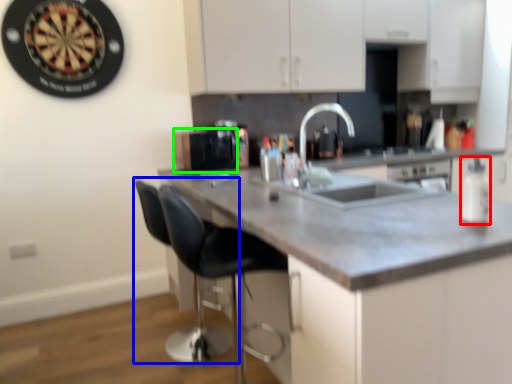
Question: Considering the real-world distances, which object is closest to bottle (highlighted by a red box)? swivel chair (highlighted by a blue box) or appliance (highlighted by a green box).

Choices:
 (A) swivel chair
 (B) appliance

Answer: (A)